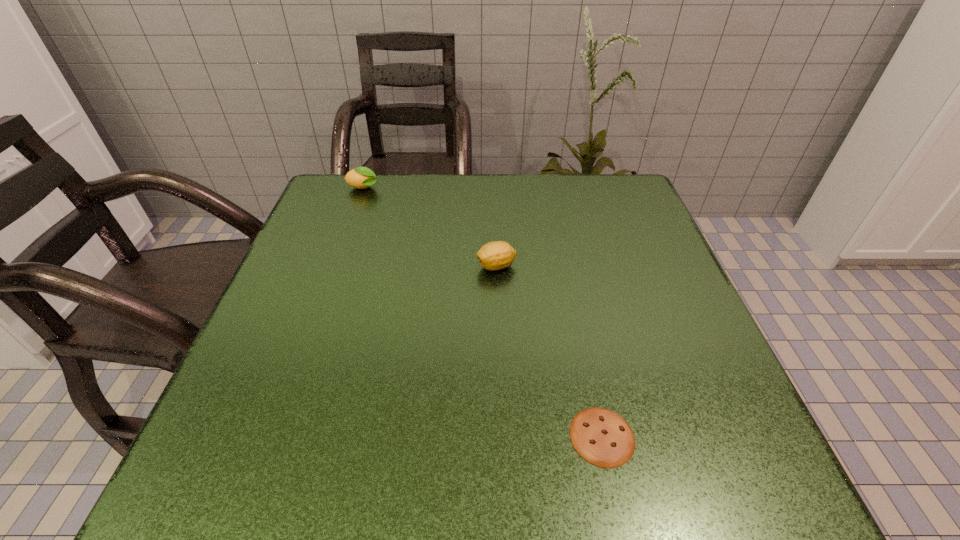
Locate an element on the screen. Image resolution: width=960 pixels, height=540 pixels. vacant space at the near left corner of the desktop is located at coordinates (288, 462).

Find the location of `vacant region between the nearer lemon and the leftmost object`. vacant region between the nearer lemon and the leftmost object is located at coordinates (430, 227).

Image resolution: width=960 pixels, height=540 pixels. I want to click on free space between the right lemon and the farther lemon, so click(x=430, y=227).

The image size is (960, 540). I want to click on free space between the farther lemon and the second object from right to left, so click(x=430, y=227).

Locate an element on the screen. The height and width of the screenshot is (540, 960). vacant point located between the rightmost object and the leftmost object is located at coordinates (483, 312).

This screenshot has height=540, width=960. I want to click on empty space between the shortest object and the farthest object, so [483, 312].

Identify the location of vacant region between the shortest object and the right lemon. The image size is (960, 540). (549, 352).

Locate an element on the screen. empty space that is in between the left lemon and the shortest object is located at coordinates (483, 312).

This screenshot has width=960, height=540. Find the location of `free space between the nearer lemon and the nearest object`. free space between the nearer lemon and the nearest object is located at coordinates (549, 352).

Where is `vacant area that lies between the nearest object and the second farthest object`? The height and width of the screenshot is (540, 960). vacant area that lies between the nearest object and the second farthest object is located at coordinates (549, 352).